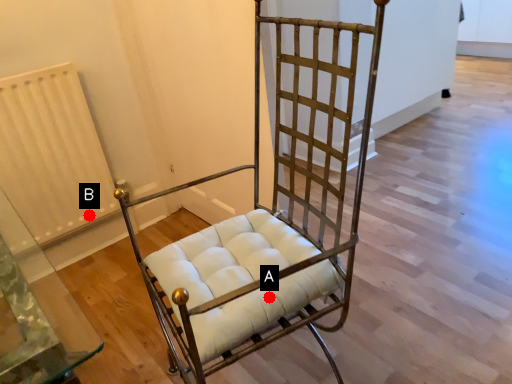
Question: Two points are circled on the image, labeled by A and B beside each circle. Among these points, which one is nearest to the camera?

Choices:
 (A) A is closer
 (B) B is closer

Answer: (A)